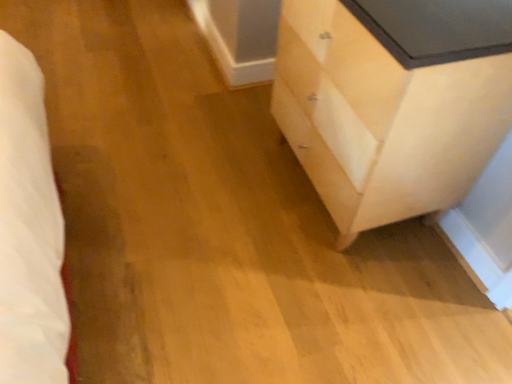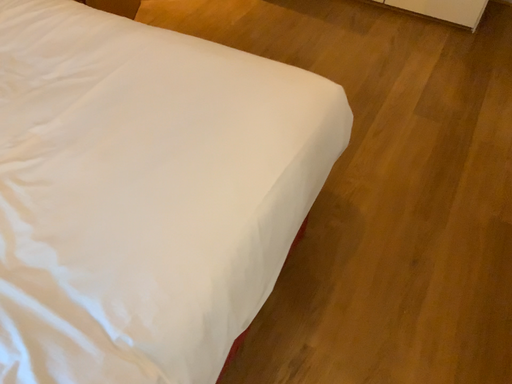
Question: How did the camera likely rotate when shooting the video?

Choices:
 (A) rotated downward
 (B) rotated upward

Answer: (B)